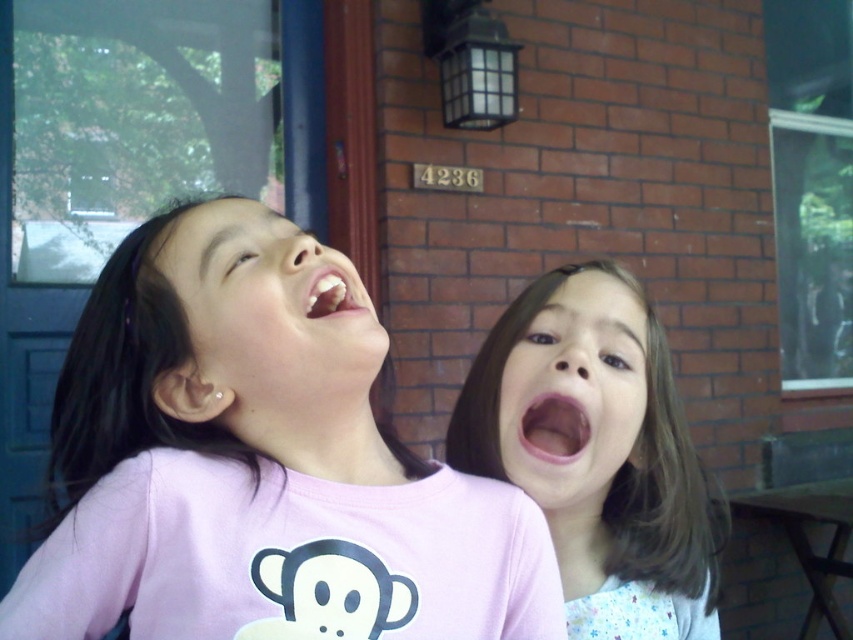
You are a photographer trying to capture a candid shot of the two girls laughing. You notice the pink matte shirt at center and the white glossy teeth at center. Which object should you focus on first if you want to ensure both are in the frame without adjusting your camera angle?

The pink matte shirt at center is taller than the white glossy teeth at center, so focusing on the pink matte shirt at center first ensures that both objects will fit within the frame since it occupies more vertical space.

You are a photographer holding a camera and want to take a closeup shot of the pink matte shirt at center. The camera requires a minimum distance of 24 inches to focus properly. Can you take the photo without moving closer?

The pink matte shirt at center and camera are 23.21 inches apart, which is less than the required 24 inches. Therefore, you cannot take the photo without moving closer to meet the focus distance requirement.